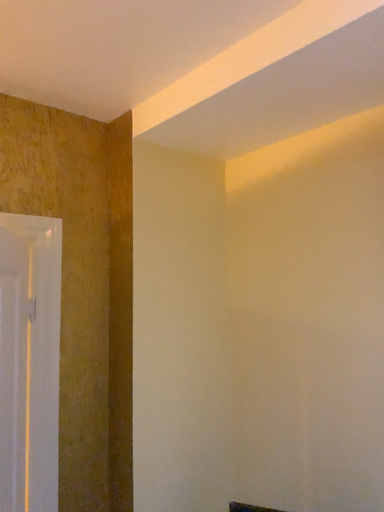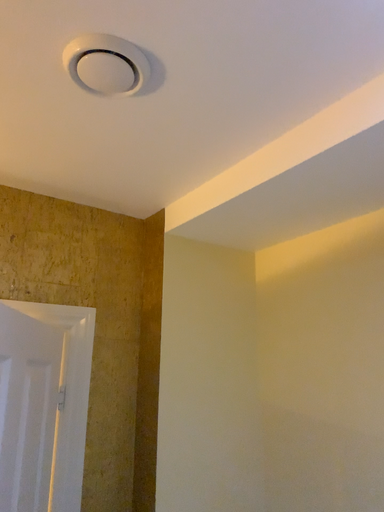
Question: How did the camera likely rotate when shooting the video?

Choices:
 (A) rotated right
 (B) rotated left

Answer: (B)